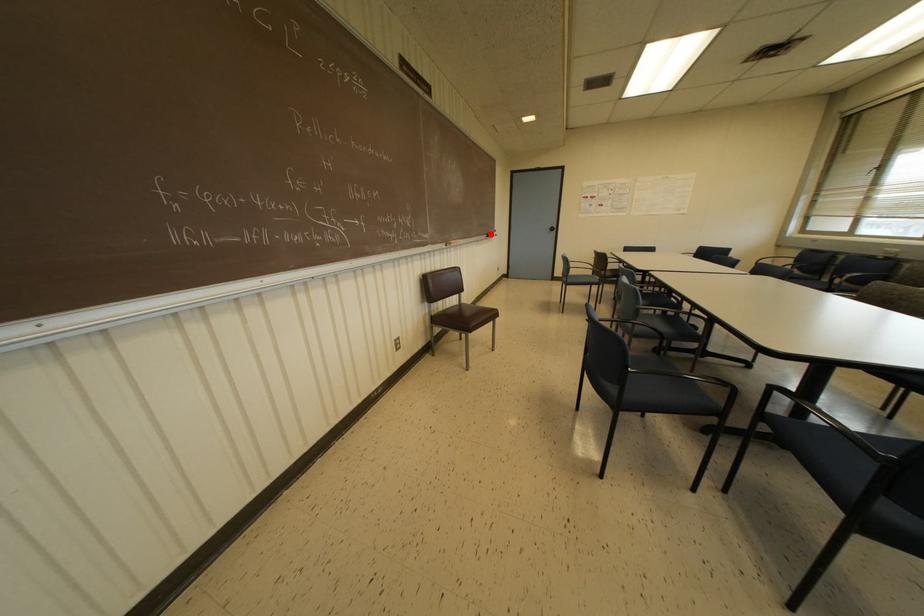
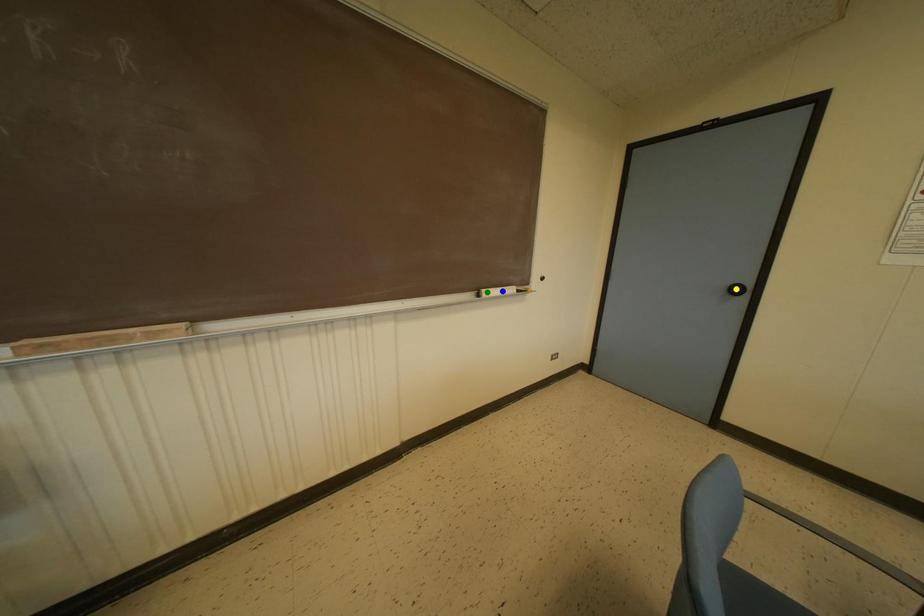
Question: I am providing you with two images of the same scene from different viewpoints. A red point is marked on the first image. You are given multiple points on the second image. In image 2, which mark is for the same physical point as the one in image 1?

Choices:
 (A) green point
 (B) blue point
 (C) yellow point

Answer: (A)